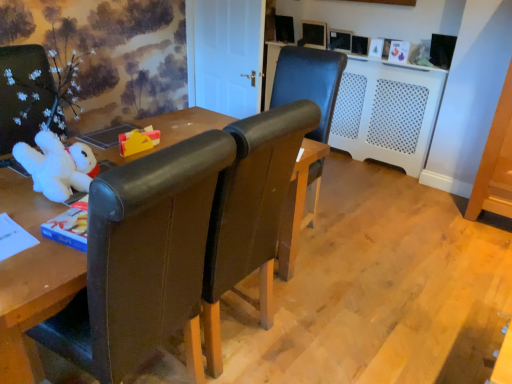
This screenshot has width=512, height=384. I want to click on vacant space to the right of leather chair at center, the second chair when ordered from front to back, so click(x=356, y=232).